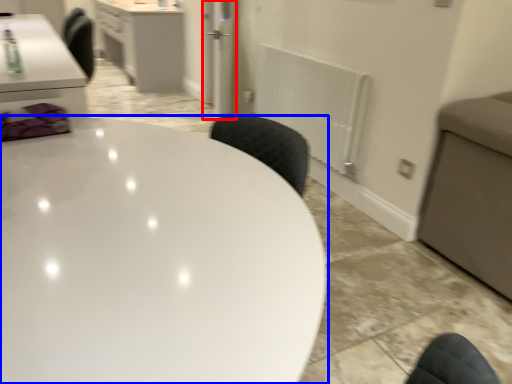
Question: Which of the following is the farthest to the observer, glass door (highlighted by a red box) or table (highlighted by a blue box)?

Choices:
 (A) glass door
 (B) table

Answer: (A)